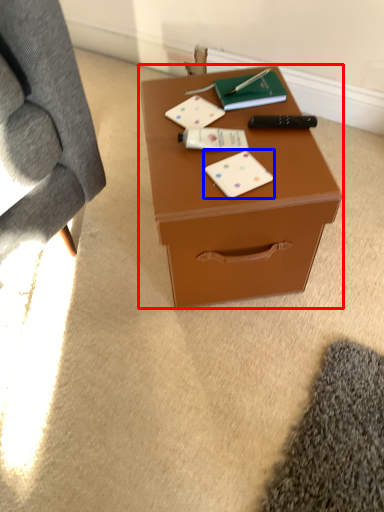
Question: Which of the following is the closest to the observer, table (highlighted by a red box) or card game (highlighted by a blue box)?

Choices:
 (A) table
 (B) card game

Answer: (A)